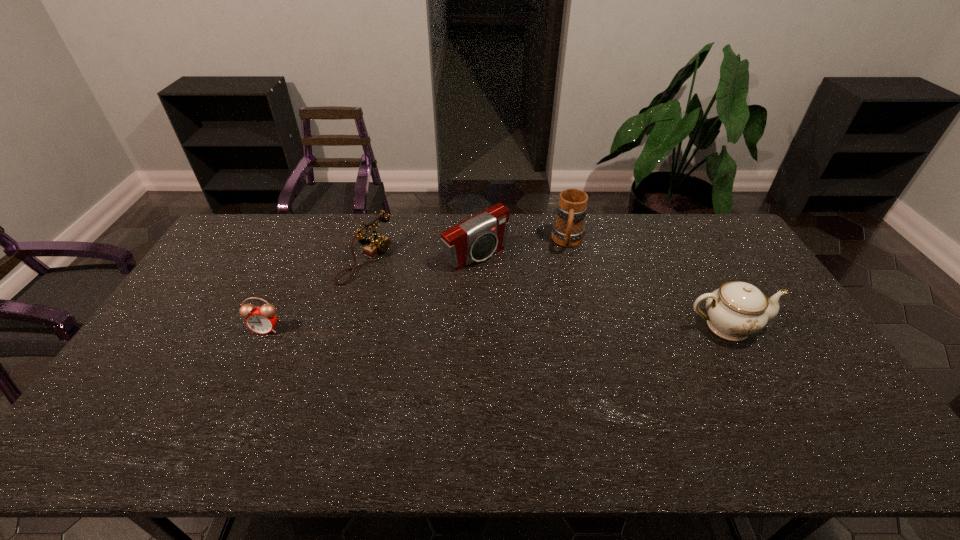
Identify the location of vacant spot on the desktop that is between the alarm clock and the rightmost object and is positioned on the front-facing side of the camera. The image size is (960, 540). (555, 327).

This screenshot has height=540, width=960. I want to click on free space on the desktop that is between the alarm clock and the chinaware and is positioned on the front-facing side of the telephone, so (521, 327).

Find the location of a particular element. The width and height of the screenshot is (960, 540). free space on the desktop that is between the leftmost object and the rightmost object and is positioned on the side of the fourth object from left to right with the handle is located at coordinates (557, 327).